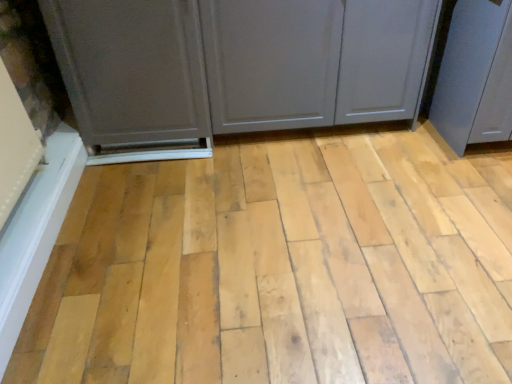
What do you see at coordinates (133, 76) in the screenshot? The image size is (512, 384). I see `matte gray cabinet at left, which appears as the second screen door when viewed from the right` at bounding box center [133, 76].

Measure the distance between point (69, 2) and camera.

A distance of 5.49 feet exists between point (69, 2) and camera.

What do you see at coordinates (238, 64) in the screenshot? This screenshot has height=384, width=512. I see `matte gray cupboard at center` at bounding box center [238, 64].

Where is `matte gray screen door at right, which appears as the 2th screen door when viewed from the left`? Image resolution: width=512 pixels, height=384 pixels. matte gray screen door at right, which appears as the 2th screen door when viewed from the left is located at coordinates (466, 68).

Image resolution: width=512 pixels, height=384 pixels. In order to click on matte gray cabinet at left, which appears as the second screen door when viewed from the right in this screenshot , I will do `click(133, 76)`.

Is matte gray cupboard at center shorter than matte gray screen door at right, the first screen door in the right-to-left sequence?

Indeed, matte gray cupboard at center has a lesser height compared to matte gray screen door at right, the first screen door in the right-to-left sequence.

Looking at this image, is there a large distance between matte gray cupboard at center and matte gray screen door at right, which appears as the 2th screen door when viewed from the left?

They are positioned close to each other.

Is matte gray cupboard at center aimed at matte gray screen door at right, which appears as the 2th screen door when viewed from the left?

No, matte gray cupboard at center is not oriented towards matte gray screen door at right, which appears as the 2th screen door when viewed from the left.

From the picture: From the image's perspective, who appears lower, natural wood plank at center or matte gray cupboard at center?

natural wood plank at center.

Does natural wood plank at center appear on the right side of matte gray cupboard at center?

In fact, natural wood plank at center is to the left of matte gray cupboard at center.

From a real-world perspective, who is located lower, natural wood plank at center or matte gray cupboard at center?

natural wood plank at center is physically lower.

Is natural wood plank at center taller than matte gray cupboard at center?

No, natural wood plank at center is not taller than matte gray cupboard at center.

Considering the relative positions of matte gray cabinet at left, the first screen door when ordered from left to right, and matte gray cupboard at center in the image provided, is matte gray cabinet at left, the first screen door when ordered from left to right, in front of matte gray cupboard at center?

Yes, the depth of matte gray cabinet at left, the first screen door when ordered from left to right, is less than that of matte gray cupboard at center.

Does matte gray cabinet at left, the first screen door when ordered from left to right, appear on the right side of matte gray cupboard at center?

Incorrect, matte gray cabinet at left, the first screen door when ordered from left to right, is not on the right side of matte gray cupboard at center.

Is matte gray screen door at right, the first screen door in the right-to-left sequence, bigger than natural wood plank at center?

Correct, matte gray screen door at right, the first screen door in the right-to-left sequence, is larger in size than natural wood plank at center.

Is matte gray screen door at right, which appears as the 2th screen door when viewed from the left, oriented away from natural wood plank at center?

That's not correct — matte gray screen door at right, which appears as the 2th screen door when viewed from the left, is not looking away from natural wood plank at center.

Based on the photo, from the image's perspective, is matte gray screen door at right, the first screen door in the right-to-left sequence, below natural wood plank at center?

Actually, matte gray screen door at right, the first screen door in the right-to-left sequence, appears above natural wood plank at center in the image.

From a real-world perspective, does matte gray screen door at right, which appears as the 2th screen door when viewed from the left, stand above natural wood plank at center?

Yes.

Can you tell me how much matte gray screen door at right, which appears as the 2th screen door when viewed from the left, and matte gray cupboard at center differ in facing direction?

0.999 degrees.

From their relative heights in the image, would you say matte gray screen door at right, which appears as the 2th screen door when viewed from the left, is taller or shorter than matte gray cupboard at center?

Clearly, matte gray screen door at right, which appears as the 2th screen door when viewed from the left, is taller compared to matte gray cupboard at center.

Based on the photo, from the image's perspective, is matte gray screen door at right, which appears as the 2th screen door when viewed from the left, under matte gray cupboard at center?

No, from the image's perspective, matte gray screen door at right, which appears as the 2th screen door when viewed from the left, is not below matte gray cupboard at center.

Can matte gray cupboard at center be found inside matte gray screen door at right, which appears as the 2th screen door when viewed from the left?

No.

Is natural wood plank at center inside or outside of matte gray cabinet at left, the first screen door when ordered from left to right?

natural wood plank at center is outside matte gray cabinet at left, the first screen door when ordered from left to right.

Between natural wood plank at center and matte gray cabinet at left, which appears as the second screen door when viewed from the right, which one has smaller width?

matte gray cabinet at left, which appears as the second screen door when viewed from the right, is thinner.

Consider the image. From a real-world perspective, is natural wood plank at center below matte gray cabinet at left, which appears as the second screen door when viewed from the right?

Correct, in the physical world, natural wood plank at center is lower than matte gray cabinet at left, which appears as the second screen door when viewed from the right.

Considering the relative positions of matte gray cabinet at left, the first screen door when ordered from left to right, and matte gray screen door at right, which appears as the 2th screen door when viewed from the left, in the image provided, is matte gray cabinet at left, the first screen door when ordered from left to right, to the right of matte gray screen door at right, which appears as the 2th screen door when viewed from the left, from the viewer's perspective?

No, matte gray cabinet at left, the first screen door when ordered from left to right, is not to the right of matte gray screen door at right, which appears as the 2th screen door when viewed from the left.

Is matte gray cabinet at left, the first screen door when ordered from left to right, next to matte gray screen door at right, which appears as the 2th screen door when viewed from the left, and touching it?

No.

Does matte gray cabinet at left, the first screen door when ordered from left to right, lie behind matte gray screen door at right, the first screen door in the right-to-left sequence?

Yes, it is behind matte gray screen door at right, the first screen door in the right-to-left sequence.

Is matte gray screen door at right, which appears as the 2th screen door when viewed from the left, located within matte gray cabinet at left, which appears as the second screen door when viewed from the right?

Definitely not — matte gray screen door at right, which appears as the 2th screen door when viewed from the left, is not inside matte gray cabinet at left, which appears as the second screen door when viewed from the right.

Where is `cupboard behind the matte gray screen door at right, which appears as the 2th screen door when viewed from the left`? The height and width of the screenshot is (384, 512). cupboard behind the matte gray screen door at right, which appears as the 2th screen door when viewed from the left is located at coordinates click(238, 64).

In the image, there is a natural wood plank at center. At what (x,y) coordinates should I click in order to perform the action: click on cupboard above it (from the image's perspective). Please return your answer as a coordinate pair (x, y). The width and height of the screenshot is (512, 384). Looking at the image, I should click on (238, 64).

From the image, which object appears to be farther from matte gray cabinet at left, the first screen door when ordered from left to right, natural wood plank at center or matte gray cupboard at center?

natural wood plank at center is further to matte gray cabinet at left, the first screen door when ordered from left to right.

From the image, which object appears to be nearer to matte gray screen door at right, which appears as the 2th screen door when viewed from the left, matte gray cupboard at center or matte gray cabinet at left, the first screen door when ordered from left to right?

matte gray cupboard at center.

Considering their positions, is matte gray screen door at right, which appears as the 2th screen door when viewed from the left, positioned closer to matte gray cabinet at left, the first screen door when ordered from left to right, than natural wood plank at center?

natural wood plank at center is positioned closer to the anchor matte gray cabinet at left, the first screen door when ordered from left to right.

When comparing their distances from matte gray cupboard at center, does matte gray screen door at right, which appears as the 2th screen door when viewed from the left, or matte gray cabinet at left, which appears as the second screen door when viewed from the right, seem closer?

matte gray cabinet at left, which appears as the second screen door when viewed from the right, lies closer to matte gray cupboard at center than the other object.

Looking at this image, when comparing their distances from matte gray screen door at right, which appears as the 2th screen door when viewed from the left, does matte gray cupboard at center or natural wood plank at center seem closer?

The object closer to matte gray screen door at right, which appears as the 2th screen door when viewed from the left, is matte gray cupboard at center.

Based on their spatial positions, is matte gray cabinet at left, which appears as the second screen door when viewed from the right, or matte gray cupboard at center further from natural wood plank at center?

Among the two, matte gray cabinet at left, which appears as the second screen door when viewed from the right, is located further to natural wood plank at center.

Based on their spatial positions, is matte gray cupboard at center or matte gray screen door at right, the first screen door in the right-to-left sequence, further from natural wood plank at center?

matte gray screen door at right, the first screen door in the right-to-left sequence.

Estimate the real-world distances between objects in this image. Which object is closer to matte gray screen door at right, which appears as the 2th screen door when viewed from the left, natural wood plank at center or matte gray cupboard at center?

Based on the image, matte gray cupboard at center appears to be nearer to matte gray screen door at right, which appears as the 2th screen door when viewed from the left.

Locate an element on the screen. plank between matte gray cabinet at left, which appears as the second screen door when viewed from the right, and matte gray cupboard at center, in the horizontal direction is located at coordinates (281, 268).

Find the location of a particular element. The image size is (512, 384). plank situated between matte gray cabinet at left, which appears as the second screen door when viewed from the right, and matte gray screen door at right, the first screen door in the right-to-left sequence, from left to right is located at coordinates (281, 268).

Where is `cupboard between natural wood plank at center and matte gray screen door at right, which appears as the 2th screen door when viewed from the left, from left to right`? The width and height of the screenshot is (512, 384). cupboard between natural wood plank at center and matte gray screen door at right, which appears as the 2th screen door when viewed from the left, from left to right is located at coordinates (238, 64).

I want to click on cupboard situated between matte gray cabinet at left, which appears as the second screen door when viewed from the right, and matte gray screen door at right, which appears as the 2th screen door when viewed from the left, from left to right, so click(x=238, y=64).